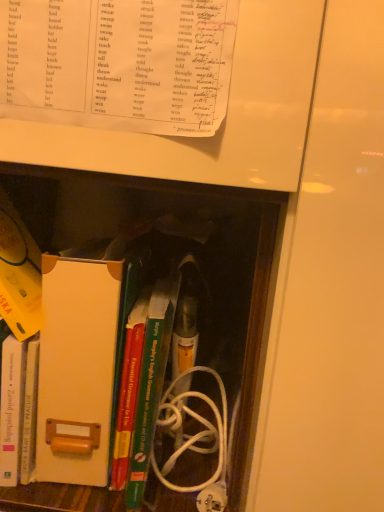
Question: From the image's perspective, is white cardboard file at center located beneath green matte book at center, the 4th book in the bottom-to-top sequence?

Choices:
 (A) yes
 (B) no

Answer: (B)

Question: From the image's perspective, is white cardboard file at center located above green matte book at center, which appears as the 2th book when viewed from the top?

Choices:
 (A) yes
 (B) no

Answer: (A)

Question: Considering the relative positions of white cardboard file at center and green matte book at center, the 4th book in the bottom-to-top sequence, in the image provided, is white cardboard file at center to the right of green matte book at center, the 4th book in the bottom-to-top sequence, from the viewer's perspective?

Choices:
 (A) no
 (B) yes

Answer: (A)

Question: Is white cardboard file at center located outside green matte book at center, the 4th book in the bottom-to-top sequence?

Choices:
 (A) yes
 (B) no

Answer: (A)

Question: Could you tell me if white cardboard file at center is turned towards green matte book at center, the 4th book in the bottom-to-top sequence?

Choices:
 (A) no
 (B) yes

Answer: (A)

Question: In the image, is white paper at upper center, the 5th book positioned from the bottom, positioned in front of or behind white cardboard file at center?

Choices:
 (A) front
 (B) behind

Answer: (A)

Question: Is point (203, 112) closer or farther from the camera than point (69, 276)?

Choices:
 (A) closer
 (B) farther

Answer: (A)

Question: From a real-world perspective, is white paper at upper center, the 1th book positioned from the top, positioned above or below white cardboard file at center?

Choices:
 (A) above
 (B) below

Answer: (A)

Question: From the image's perspective, is white paper at upper center, the 5th book positioned from the bottom, positioned above or below white cardboard file at center?

Choices:
 (A) above
 (B) below

Answer: (A)

Question: Looking at the image, does white paper at upper center, the 1th book positioned from the top, seem bigger or smaller compared to hardcover book at left, which is the 5th book from top to bottom?

Choices:
 (A) big
 (B) small

Answer: (A)

Question: Considering the positions of white paper at upper center, the 1th book positioned from the top, and hardcover book at left, acting as the 1th book starting from the bottom, in the image, is white paper at upper center, the 1th book positioned from the top, taller or shorter than hardcover book at left, acting as the 1th book starting from the bottom,?

Choices:
 (A) tall
 (B) short

Answer: (A)

Question: From a real-world perspective, relative to hardcover book at left, which is the 5th book from top to bottom, is white paper at upper center, the 5th book positioned from the bottom, vertically above or below?

Choices:
 (A) above
 (B) below

Answer: (A)

Question: In the image, is white paper at upper center, the 5th book positioned from the bottom, on the left side or the right side of hardcover book at left, acting as the 1th book starting from the bottom?

Choices:
 (A) left
 (B) right

Answer: (B)

Question: Is green matte book at center, the 4th book in the bottom-to-top sequence, taller or shorter than white paper at upper center, the 5th book positioned from the bottom?

Choices:
 (A) short
 (B) tall

Answer: (A)

Question: Considering their positions, is green matte book at center, the 4th book in the bottom-to-top sequence, located in front of or behind white paper at upper center, the 1th book positioned from the top?

Choices:
 (A) front
 (B) behind

Answer: (B)